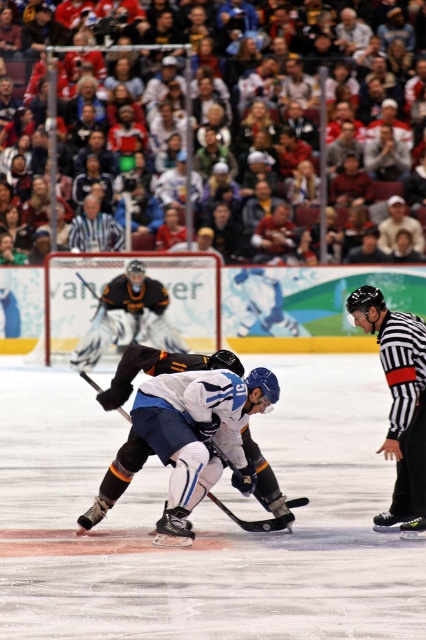
You are an ice hockey player trying to pass the puck to a teammate. You have two points marked on the ice at coordinates point [178,336] and point [285,516]. Which point is closer to you, the player?

Point [178,336] is closer to you because it is further to the viewer than point [285,516], meaning it is nearer to your position.